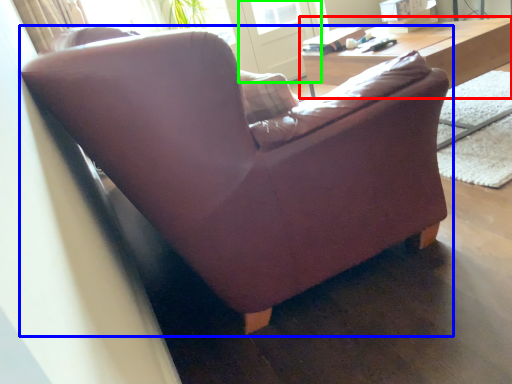
Question: Which object is positioned closest to table (highlighted by a red box)? Select from studio couch (highlighted by a blue box) and screen door (highlighted by a green box).

Choices:
 (A) studio couch
 (B) screen door

Answer: (A)